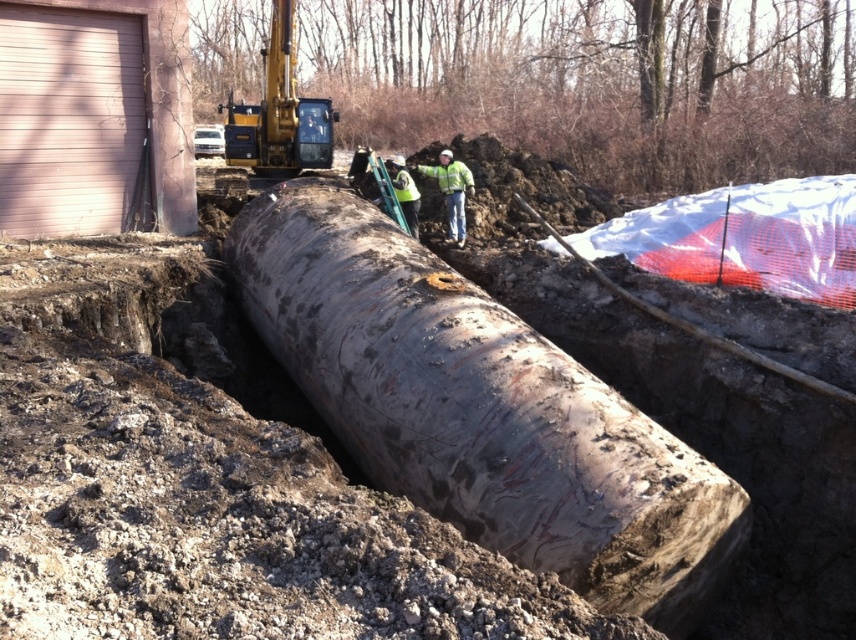
Question: Considering the relative positions of high visibility yellow jacket at center and green reflective vest at center in the image provided, where is high visibility yellow jacket at center located with respect to green reflective vest at center?

Choices:
 (A) left
 (B) right

Answer: (B)

Question: Which point is closer to the camera?

Choices:
 (A) (444, 429)
 (B) (434, 172)
 (C) (298, 104)

Answer: (A)

Question: Among these points, which one is nearest to the camera?

Choices:
 (A) (402, 182)
 (B) (265, 163)

Answer: (A)

Question: Can you confirm if rusty metallic water pipe at center is positioned to the right of green reflective vest at center?

Choices:
 (A) yes
 (B) no

Answer: (A)

Question: Considering the real-world distances, which object is farthest from the yellow metallic excavator at upper center?

Choices:
 (A) rusty metallic water pipe at center
 (B) high visibility yellow jacket at center

Answer: (A)

Question: Can you confirm if rusty metallic water pipe at center is wider than yellow metallic excavator at upper center?

Choices:
 (A) no
 (B) yes

Answer: (A)